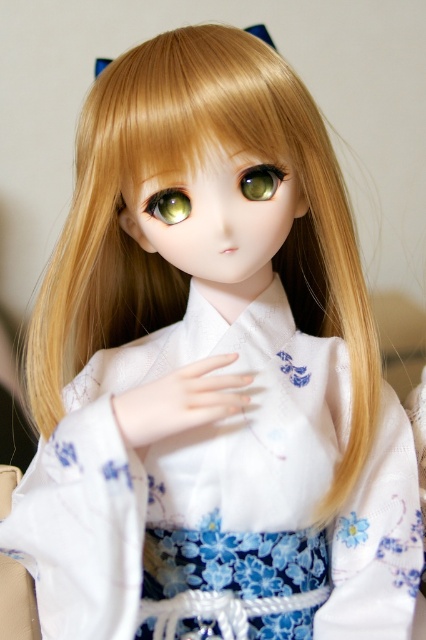
Question: Which point is closer to the camera?

Choices:
 (A) green glossy eye at center
 (B) green matte eye at center

Answer: (B)

Question: Can you confirm if green matte eye at center is smaller than green glossy eye at center?

Choices:
 (A) yes
 (B) no

Answer: (A)

Question: Does green matte eye at center have a smaller size compared to green glossy eye at center?

Choices:
 (A) yes
 (B) no

Answer: (A)

Question: Which point appears farthest from the camera in this image?

Choices:
 (A) (250, 179)
 (B) (146, 209)

Answer: (B)

Question: Which point is closer to the camera?

Choices:
 (A) (155, 193)
 (B) (276, 184)

Answer: (A)

Question: Can you confirm if green matte eye at center is bigger than green glossy eye at center?

Choices:
 (A) yes
 (B) no

Answer: (B)